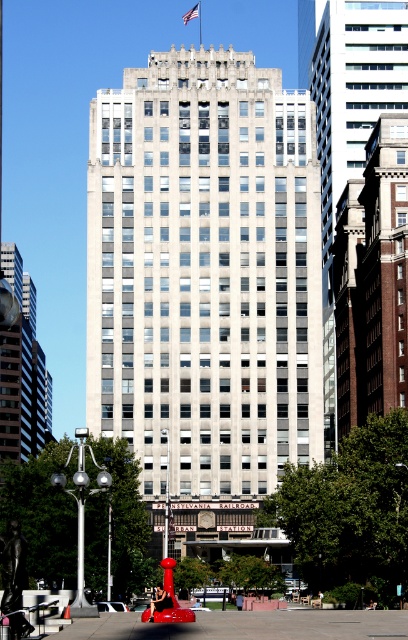
Can you confirm if white glass building at center is smaller than glassy reflective tower at left?

Actually, white glass building at center might be larger than glassy reflective tower at left.

Measure the distance between white glass building at center and camera.

white glass building at center and camera are 361.32 feet apart from each other.

Is point (148, 419) closer to viewer compared to point (2, 390)?

Yes.

The image size is (408, 640). What are the coordinates of `white glass building at center` in the screenshot? It's located at (204, 276).

Between white glass building at center and red fabric flag at upper center, which one is positioned higher?

red fabric flag at upper center is above.

Can you confirm if white glass building at center is positioned below red fabric flag at upper center?

Yes.

The image size is (408, 640). Find the location of `white glass building at center`. white glass building at center is located at coordinates (204, 276).

This screenshot has width=408, height=640. Describe the element at coordinates (112, 605) in the screenshot. I see `metallic silver car at center` at that location.

Does metallic silver car at center have a lesser height compared to red plastic traffic cone at center?

No.

The image size is (408, 640). Find the location of `metallic silver car at center`. metallic silver car at center is located at coordinates (112, 605).